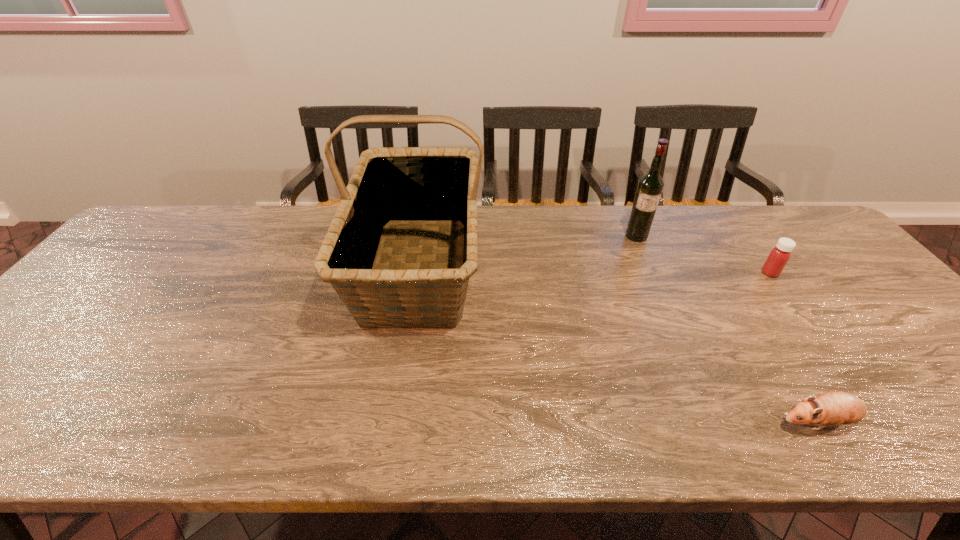
Find the location of a particular element. Image resolution: width=960 pixels, height=540 pixels. free space at the right edge of the desktop is located at coordinates (857, 300).

Find the location of a particular element. free spot between the second object from right to left and the basket is located at coordinates (618, 345).

Where is `free spot between the tallest object and the wine bottle`? The image size is (960, 540). free spot between the tallest object and the wine bottle is located at coordinates (527, 251).

Find the location of a particular element. The image size is (960, 540). free space between the basket and the third tallest object is located at coordinates (594, 269).

Locate an element on the screen. The height and width of the screenshot is (540, 960). vacant area that lies between the third tallest object and the third shortest object is located at coordinates (703, 254).

Locate an element on the screen. This screenshot has width=960, height=540. unoccupied area between the third tallest object and the wine bottle is located at coordinates (703, 254).

In order to click on free space that is in between the rightmost object and the third object from right to left in this screenshot , I will do `click(703, 254)`.

This screenshot has height=540, width=960. What are the coordinates of `empty space that is in between the medicine and the leftmost object` in the screenshot? It's located at click(x=594, y=269).

Where is `free spot between the second object from left to right and the nearest object`? This screenshot has width=960, height=540. free spot between the second object from left to right and the nearest object is located at coordinates (727, 329).

The width and height of the screenshot is (960, 540). I want to click on free space that is in between the medicine and the second tallest object, so coord(703,254).